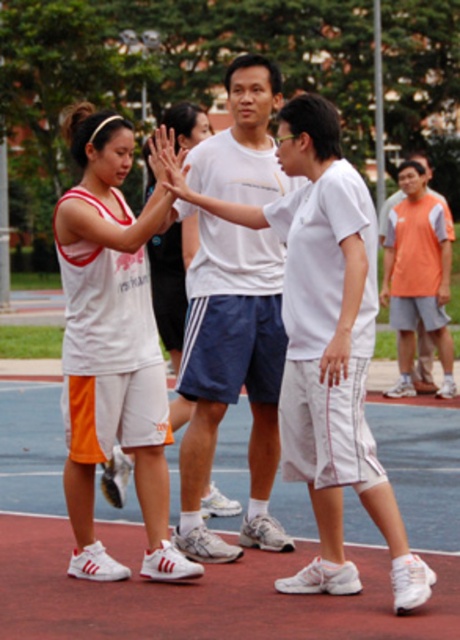
You are standing at the point marked as point (81, 275) on the court. If you want to throw a ball to someone standing 20.24 feet away, will you be able to reach the other person without moving?

Yes, because the distance between them is exactly 20.24 feet, so throwing the ball that distance would reach the other person without needing to move.

You are standing on the basketball court and notice two objects in the scene. One is the white synthetic court at center and the other is the white matte shorts at center. Based on their positions, which object is located to the right of the other?

The white synthetic court at center is located to the right of the white matte shorts at center.